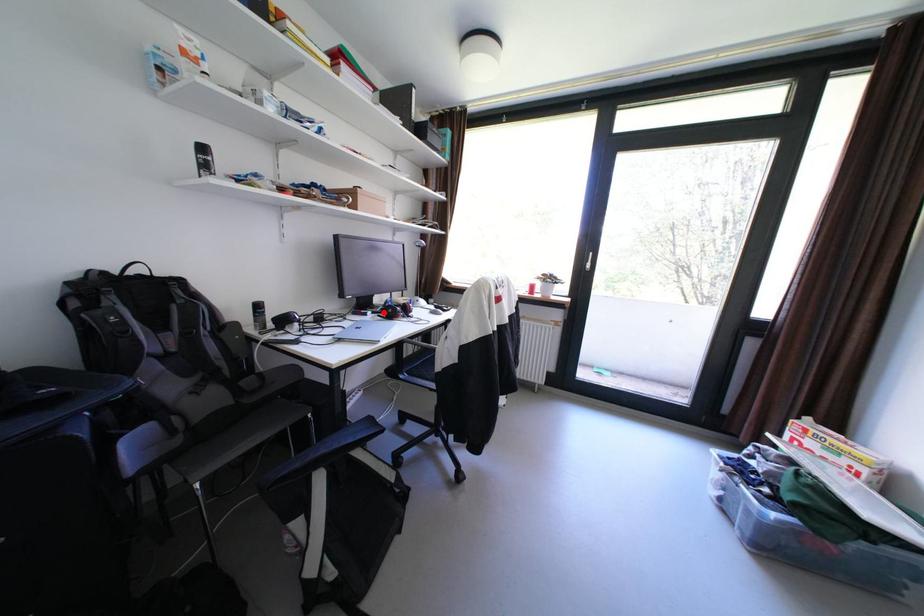
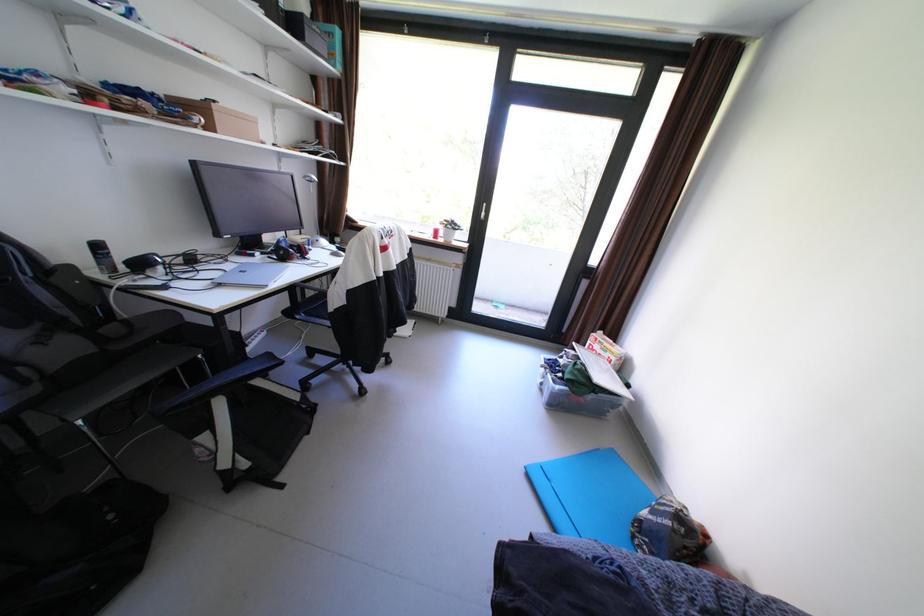
In the second image, find the point that corresponds to the highlighted location in the first image.

(274, 254)